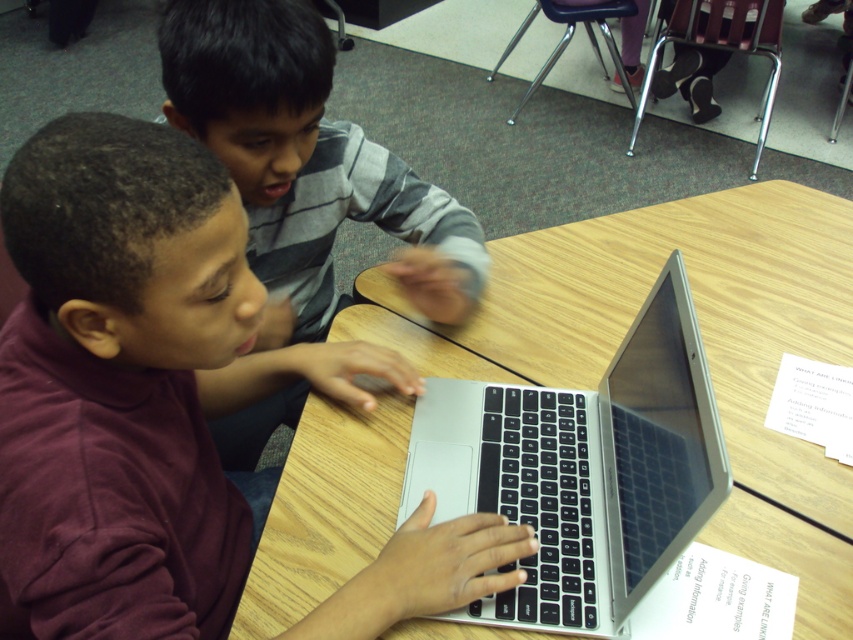
Between maroon fabric shirt at lower left and gray striped sweater at upper center, which one appears on the right side from the viewer's perspective?

gray striped sweater at upper center is more to the right.

Which of these two, maroon fabric shirt at lower left or gray striped sweater at upper center, stands shorter?

maroon fabric shirt at lower left

The image size is (853, 640). Identify the location of maroon fabric shirt at lower left. (134, 371).

Is maroon fabric shirt at lower left wider than wooden table at center?

In fact, maroon fabric shirt at lower left might be narrower than wooden table at center.

Which of these two, maroon fabric shirt at lower left or wooden table at center, stands taller?

With more height is wooden table at center.

Does point (234, 314) lie behind point (413, 310)?

No, (234, 314) is closer to viewer.

Find the location of a particular element. This screenshot has width=853, height=640. maroon fabric shirt at lower left is located at coordinates (134, 371).

Based on the photo, can you confirm if wooden table at center is positioned below gray striped sweater at upper center?

Correct, wooden table at center is located below gray striped sweater at upper center.

Is point (352, 547) closer to viewer compared to point (352, 141)?

That is True.

Who is more forward, (x=538, y=369) or (x=299, y=4)?

Point (x=299, y=4) is more forward.

Locate an element on the screen. This screenshot has width=853, height=640. wooden table at center is located at coordinates (703, 340).